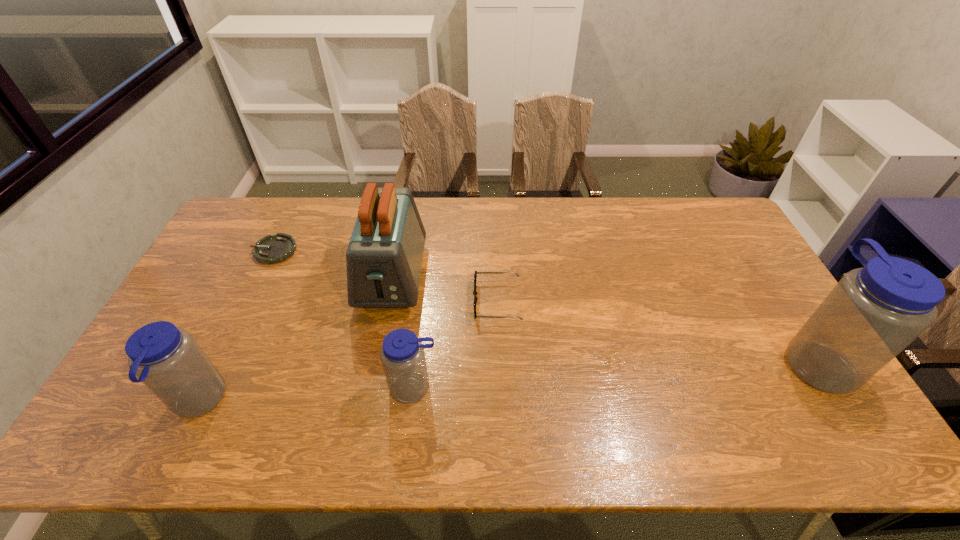
Image resolution: width=960 pixels, height=540 pixels. In order to click on vacant space located 0.050m with a carrying loop on the side of the second shortest water bottle in this screenshot , I will do `click(153, 402)`.

This screenshot has width=960, height=540. I want to click on free spot located 0.080m with a carrying loop on the side of the second shortest water bottle, so click(x=141, y=402).

I want to click on vacant region located 0.100m with a carrying loop on the side of the second shortest water bottle, so click(x=132, y=402).

Where is `vacant area located on the front of the ashtray`? vacant area located on the front of the ashtray is located at coordinates (217, 370).

Image resolution: width=960 pixels, height=540 pixels. I want to click on blank area located 0.080m on the front-facing side of the toaster, so coord(380,341).

Identify the location of vacant space positioned 0.230m on the front-facing side of the spectacles. (397, 301).

Locate an element on the screen. free region located on the front-facing side of the spectacles is located at coordinates (377, 301).

This screenshot has width=960, height=540. Find the location of `vacant area situated 0.310m on the front-facing side of the spectacles`. vacant area situated 0.310m on the front-facing side of the spectacles is located at coordinates (371, 301).

You are a GUI agent. You are given a task and a screenshot of the screen. Output one action in this format:
    pyautogui.click(x=<x>, y=<y>)
    Task: Click on the object at the far edge
    
    Given the screenshot: What is the action you would take?
    pyautogui.click(x=271, y=249)

Image resolution: width=960 pixels, height=540 pixels. What are the coordinates of `water bottle present at the left edge` in the screenshot? It's located at (167, 359).